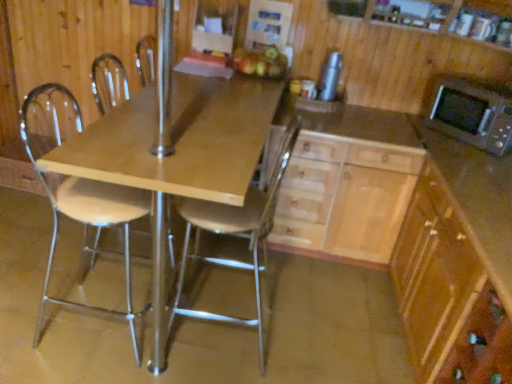
The width and height of the screenshot is (512, 384). I want to click on spots to the right of metallic silver chair at center, which is counted as the second chair, starting from the left, so click(x=315, y=341).